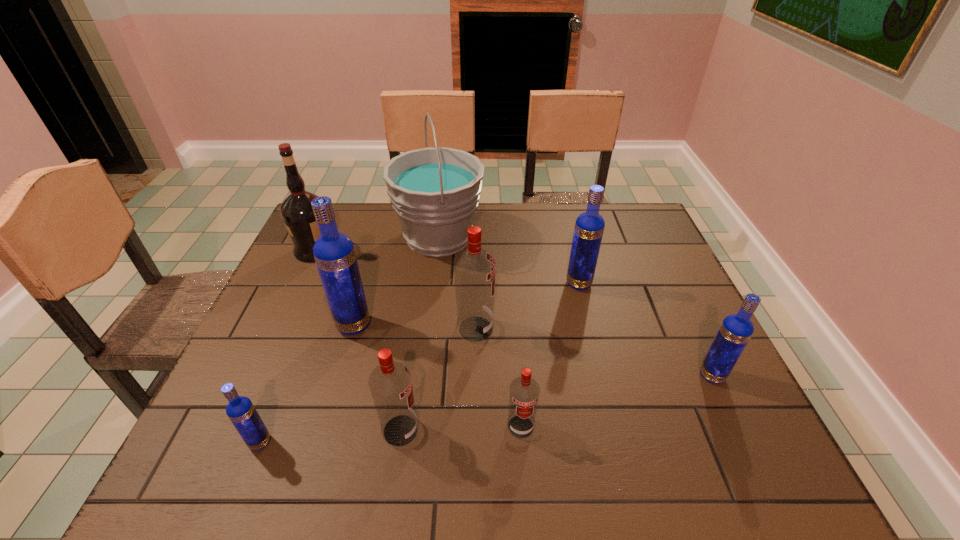
Where is `free space located 0.220m on the front label of the second red vodka from left to right`? This screenshot has height=540, width=960. free space located 0.220m on the front label of the second red vodka from left to right is located at coordinates (583, 329).

I want to click on vacant space located on the back of the fourth farthest vodka, so click(678, 304).

Locate an element on the screen. vacant space located on the front label of the second smallest red vodka is located at coordinates (x=528, y=430).

At what (x,y) coordinates should I click in order to perform the action: click on vacant region located on the right of the leftmost vodka. Please return your answer as a coordinate pair (x, y). Looking at the image, I should click on (397, 442).

Locate an element on the screen. The width and height of the screenshot is (960, 540). bucket at the far edge is located at coordinates (435, 191).

Image resolution: width=960 pixels, height=540 pixels. Find the location of `liquor that is at the far edge`. liquor that is at the far edge is located at coordinates (296, 210).

What are the coordinates of `liquor positioned at the left edge` in the screenshot? It's located at (296, 210).

Locate an element on the screen. This screenshot has height=540, width=960. vodka that is at the left edge is located at coordinates (240, 410).

The width and height of the screenshot is (960, 540). Identify the location of object situated at the right edge. (735, 331).

Locate an element on the screen. object that is at the far left corner is located at coordinates (296, 210).